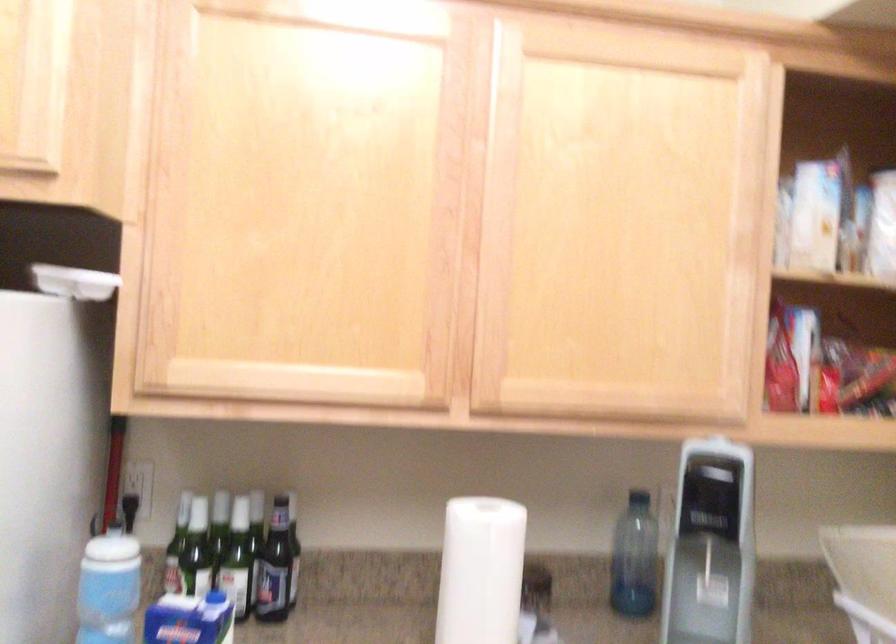
What do you see at coordinates (216, 597) in the screenshot? I see `the blue carton cap` at bounding box center [216, 597].